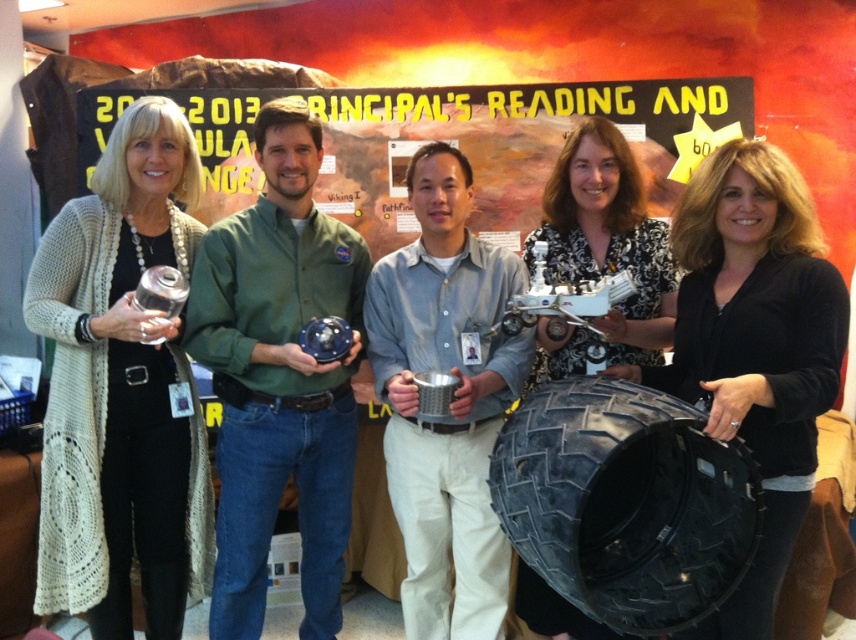
Question: Which point is farther to the camera?

Choices:
 (A) green matte shirt at center
 (B) black matte tire at center

Answer: (A)

Question: Which of the following is the farthest from the observer?

Choices:
 (A) (616, 332)
 (B) (284, 294)
 (C) (177, 196)

Answer: (C)

Question: Can you confirm if green matte shirt at center is bigger than black floral blouse at center?

Choices:
 (A) no
 (B) yes

Answer: (B)

Question: Does white knitted cardigan at left appear over black matte tire at center?

Choices:
 (A) no
 (B) yes

Answer: (B)

Question: Which object is the farthest from the white knitted cardigan at left?

Choices:
 (A) green matte shirt at center
 (B) metallic silver cup at center
 (C) black matte tire at center

Answer: (C)

Question: Is black matte tire at center thinner than black floral blouse at center?

Choices:
 (A) no
 (B) yes

Answer: (A)